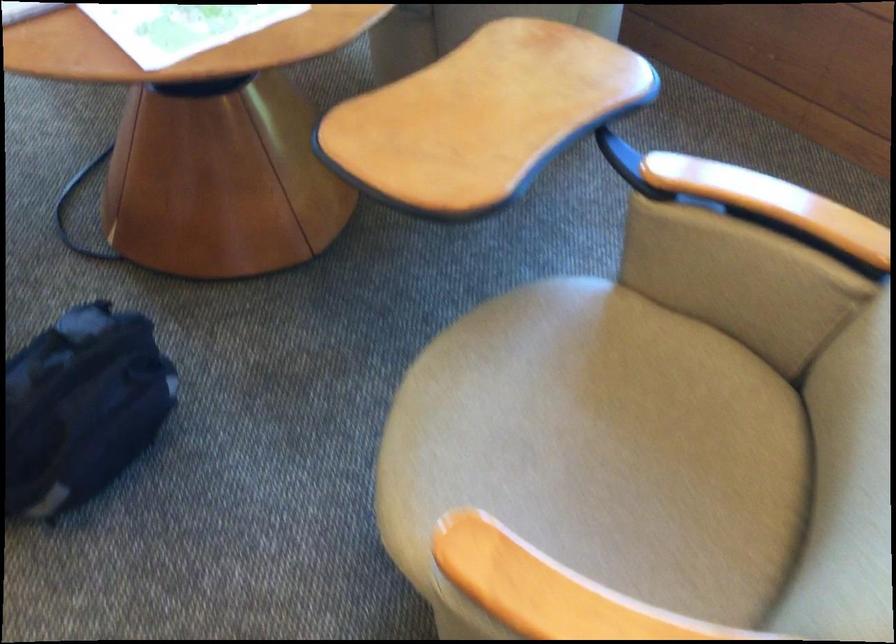
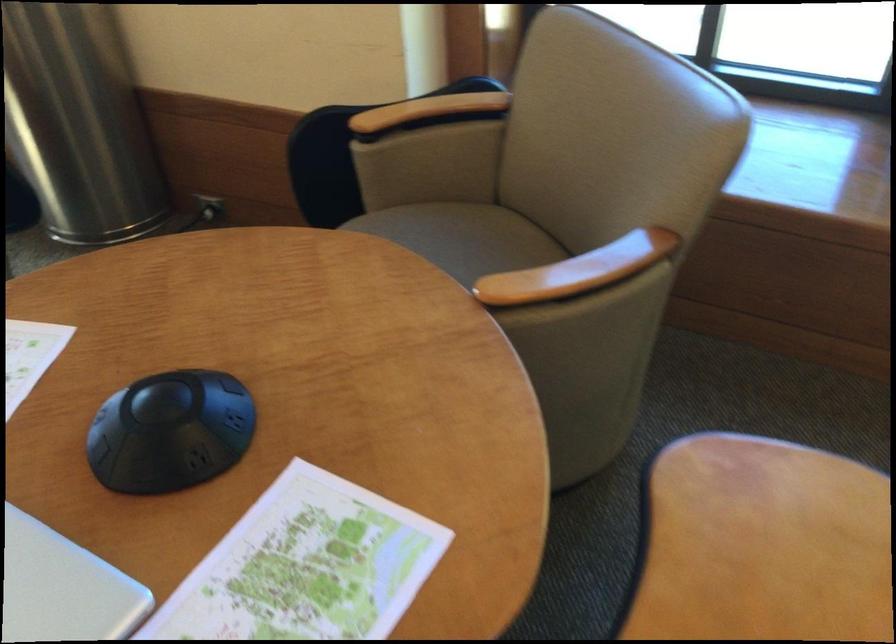
Which direction would the cameraman need to move to produce the second image?

The cameraman walked toward left, forward.